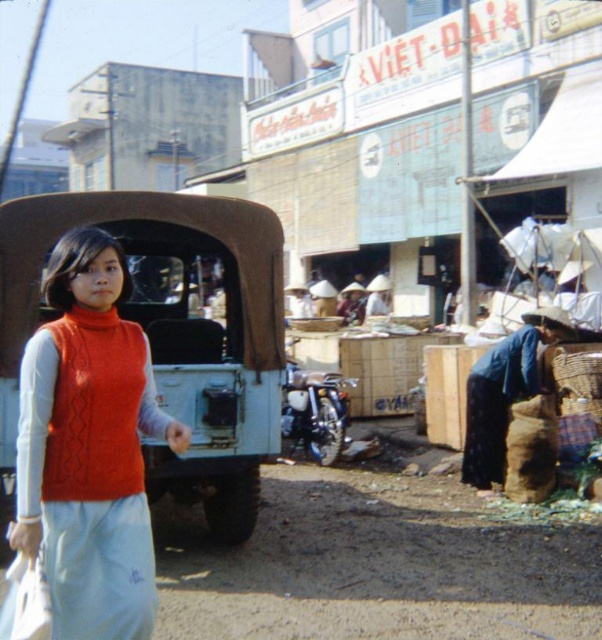
Question: Observing the image, what is the correct spatial positioning of cable-knit sweater at center in reference to blue fabric bag at lower right?

Choices:
 (A) left
 (B) right

Answer: (A)

Question: Among these points, which one is nearest to the camera?

Choices:
 (A) (497, 360)
 (B) (99, 269)

Answer: (B)

Question: Does cable-knit sweater at center have a smaller size compared to blue fabric bag at lower right?

Choices:
 (A) yes
 (B) no

Answer: (A)

Question: Which object is closer to the camera taking this photo?

Choices:
 (A) blue fabric bag at lower right
 (B) cable-knit sweater at center

Answer: (B)

Question: Which point appears farthest from the camera in this image?

Choices:
 (A) (492, 428)
 (B) (137, 396)

Answer: (A)

Question: Is cable-knit sweater at center below blue fabric bag at lower right?

Choices:
 (A) no
 (B) yes

Answer: (A)